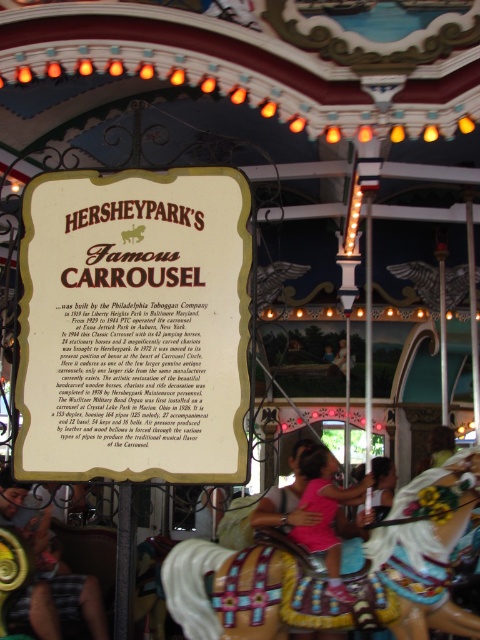
Question: Can you confirm if white paper sign at center is positioned below wooden painted horse at center?

Choices:
 (A) yes
 (B) no

Answer: (B)

Question: Can you confirm if white paper sign at center is positioned below wooden painted horse at center?

Choices:
 (A) yes
 (B) no

Answer: (B)

Question: Which object is farther from the camera taking this photo?

Choices:
 (A) white paper sign at center
 (B) wooden painted horse at center

Answer: (A)

Question: Among these points, which one is nearest to the camera?

Choices:
 (A) (222, 600)
 (B) (26, 365)

Answer: (A)

Question: Can you confirm if white paper sign at center is bigger than wooden painted horse at center?

Choices:
 (A) yes
 (B) no

Answer: (B)